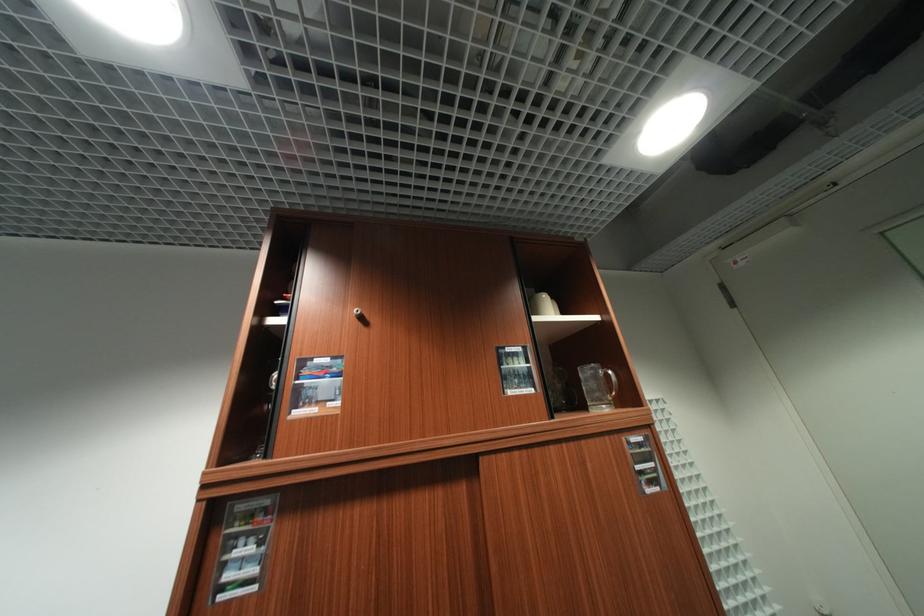
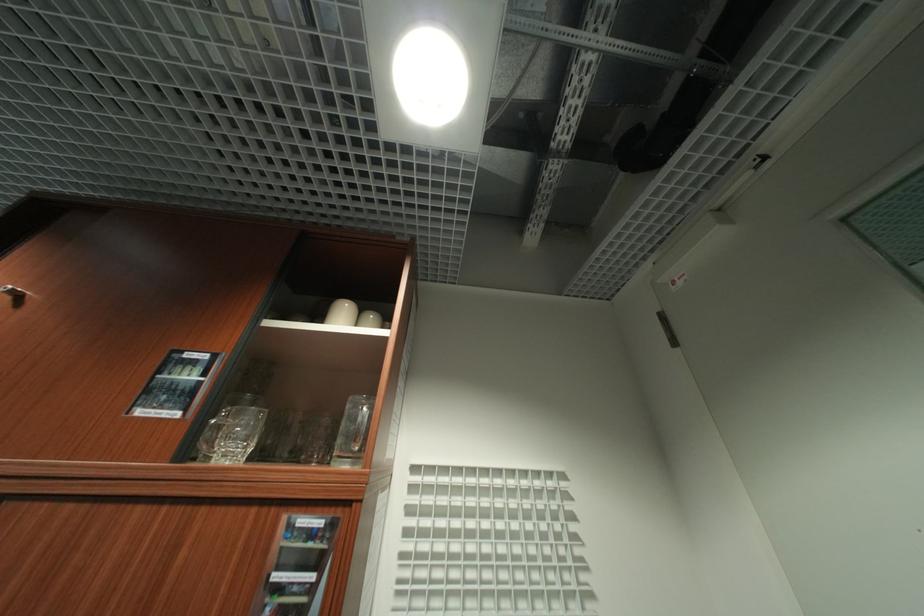
Question: The camera is either moving clockwise (left) or counter-clockwise (right) around the object. The first image is from the beginning of the video and the second image is from the end. Is the camera moving left or right when shooting the video?

Choices:
 (A) Left
 (B) Right

Answer: (B)